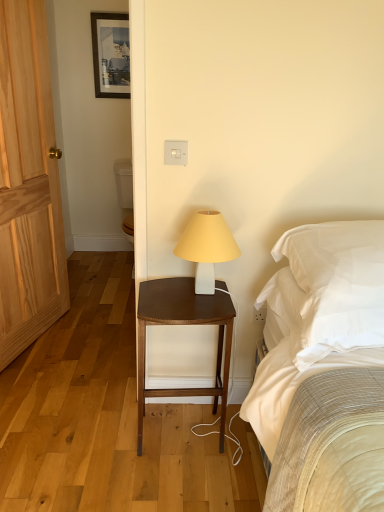
Find the location of a particular element. The height and width of the screenshot is (512, 384). free region under light wood door at left (from a real-world perspective) is located at coordinates tap(37, 343).